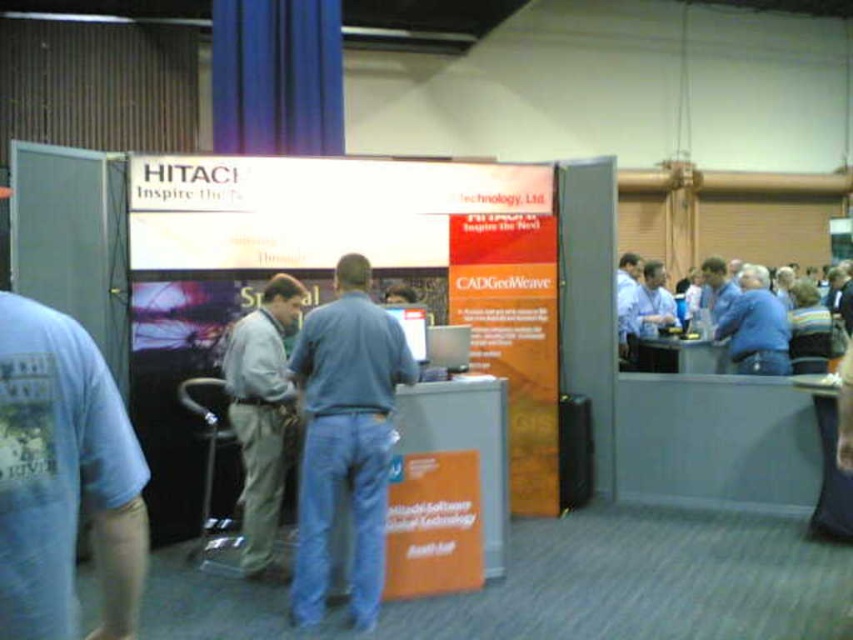
From the picture: Is light gray fabric pants at center wider than blue shirt at center?

No.

Does light gray fabric pants at center lie behind blue shirt at center?

That is False.

Image resolution: width=853 pixels, height=640 pixels. In order to click on light gray fabric pants at center in this screenshot , I will do `click(260, 413)`.

Does blue jeans at center have a larger size compared to light gray fabric pants at center?

Actually, blue jeans at center might be smaller than light gray fabric pants at center.

Does blue jeans at center appear under light gray fabric pants at center?

Actually, blue jeans at center is above light gray fabric pants at center.

The height and width of the screenshot is (640, 853). Describe the element at coordinates (345, 436) in the screenshot. I see `blue jeans at center` at that location.

This screenshot has height=640, width=853. What are the coordinates of `blue jeans at center` in the screenshot? It's located at (345, 436).

Does blue jeans at center appear under blue shirt at center?

Indeed, blue jeans at center is positioned under blue shirt at center.

Is blue jeans at center wider than blue shirt at center?

Incorrect, blue jeans at center's width does not surpass blue shirt at center's.

Who is more forward, (322, 324) or (656, 340)?

Point (322, 324) is in front.

Locate an element on the screen. blue jeans at center is located at coordinates (345, 436).